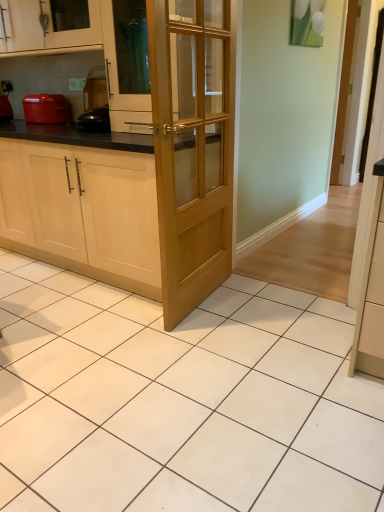
Question: From the image's perspective, relative to matte red pot at left, is light brown wooden door at center above or below?

Choices:
 (A) above
 (B) below

Answer: (B)

Question: Looking at their shapes, would you say light brown wooden door at center is wider or thinner than matte red pot at left?

Choices:
 (A) thin
 (B) wide

Answer: (A)

Question: Estimate the real-world distances between objects in this image. Which object is farther from the matte red pot at left?

Choices:
 (A) matte wood cabinet at upper left, which is counted as the 2th cabinetry, starting from the bottom
 (B) light brown wooden door at center
 (C) matte red pot at left
 (D) light wood cabinet at center, acting as the 2th cabinetry starting from the top

Answer: (B)

Question: Which is nearer to the light brown wooden door at center?

Choices:
 (A) matte red pot at left
 (B) matte red pot at left
 (C) matte wood cabinet at upper left, the first cabinetry when ordered from top to bottom
 (D) light wood cabinet at center, acting as the 2th cabinetry starting from the top

Answer: (D)